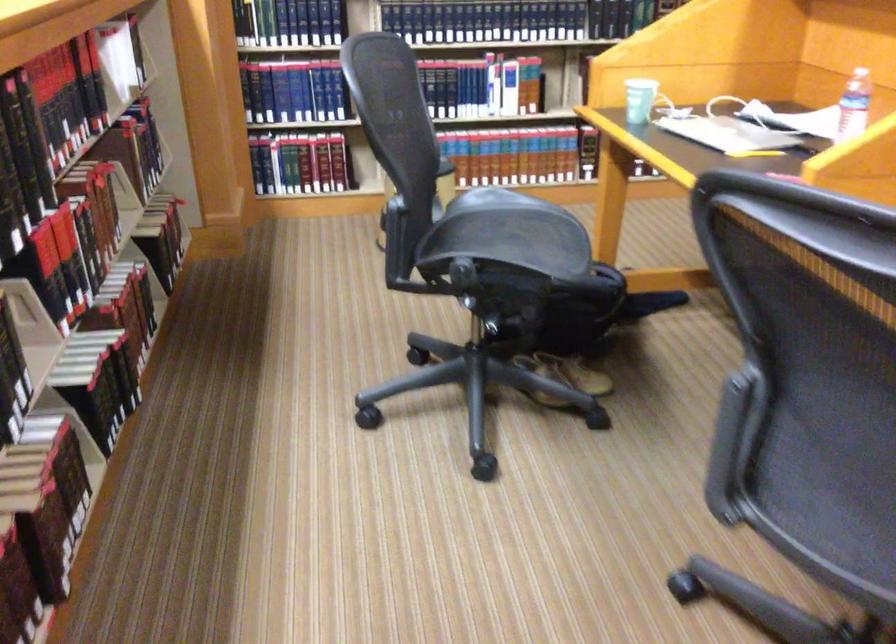
Find where to sit the chair sitting surface. Please return your answer as a coordinate pair (x, y).

(500, 221)